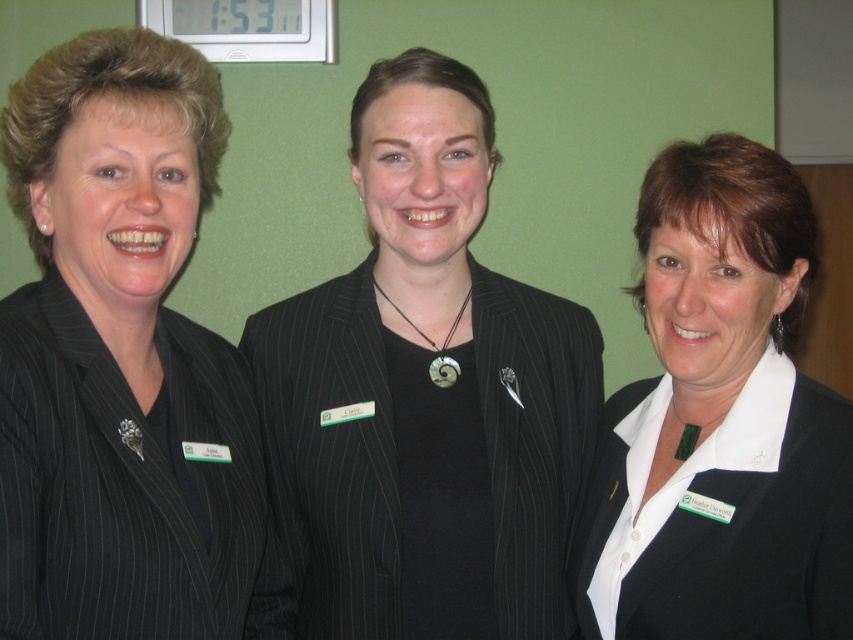
Question: Does matte black suit at left have a smaller size compared to white matte blazer at center?

Choices:
 (A) yes
 (B) no

Answer: (A)

Question: Which point is closer to the camera?

Choices:
 (A) (271, 369)
 (B) (50, 380)

Answer: (B)

Question: Which object appears closest to the camera in this image?

Choices:
 (A) matte black suit at left
 (B) black pinstripe suit at center
 (C) white matte blazer at center

Answer: (A)

Question: Can you confirm if matte black suit at left is positioned below black pinstripe suit at center?

Choices:
 (A) no
 (B) yes

Answer: (A)

Question: Can you confirm if matte black suit at left is positioned to the left of white matte blazer at center?

Choices:
 (A) no
 (B) yes

Answer: (B)

Question: Which point is closer to the camera?

Choices:
 (A) black pinstripe suit at center
 (B) white matte blazer at center

Answer: (B)